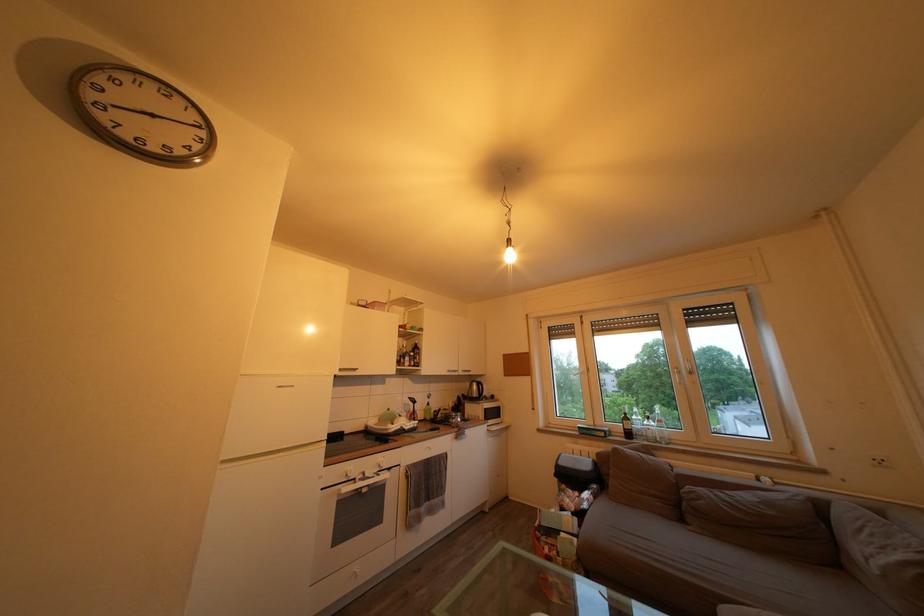
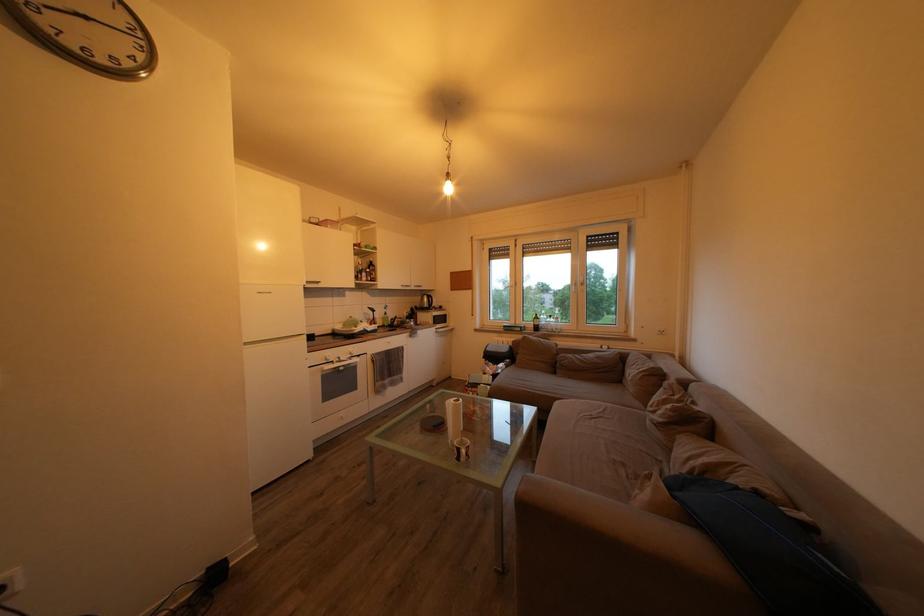
In the second image, find the point that corresponds to the point at 375,480 in the first image.

(349, 363)